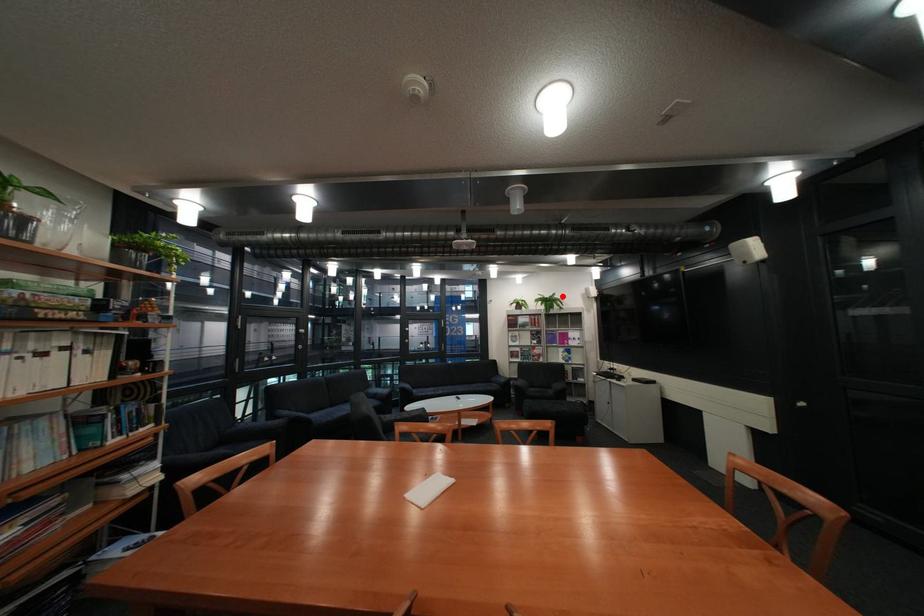
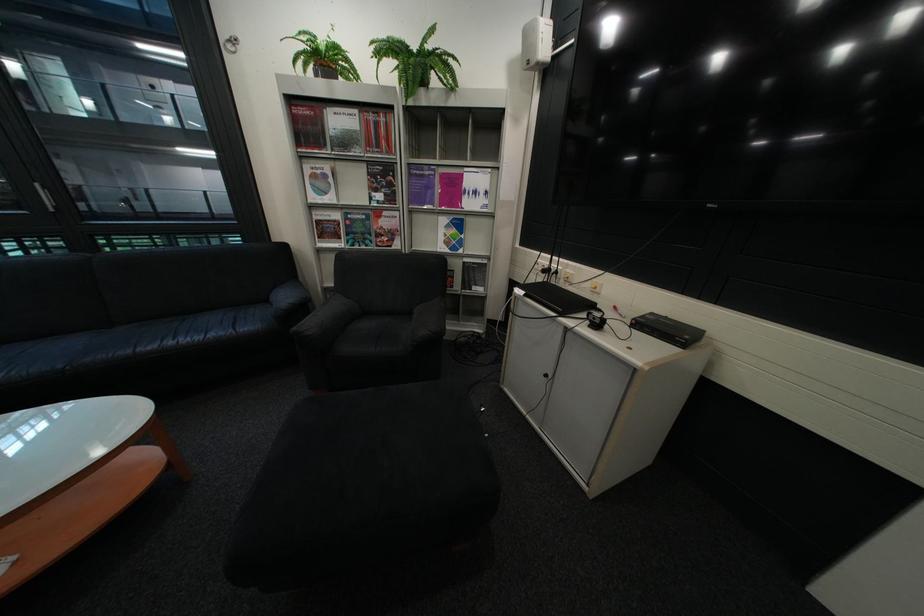
Find the pixel in the second image that matches the highlighted location in the first image.

(430, 46)